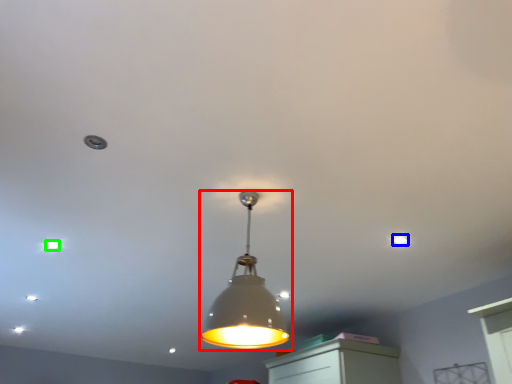
Question: Which object is the closest to the lamp (highlighted by a red box)? Choose among these: dot (highlighted by a blue box) or dot (highlighted by a green box).

Choices:
 (A) dot
 (B) dot

Answer: (A)